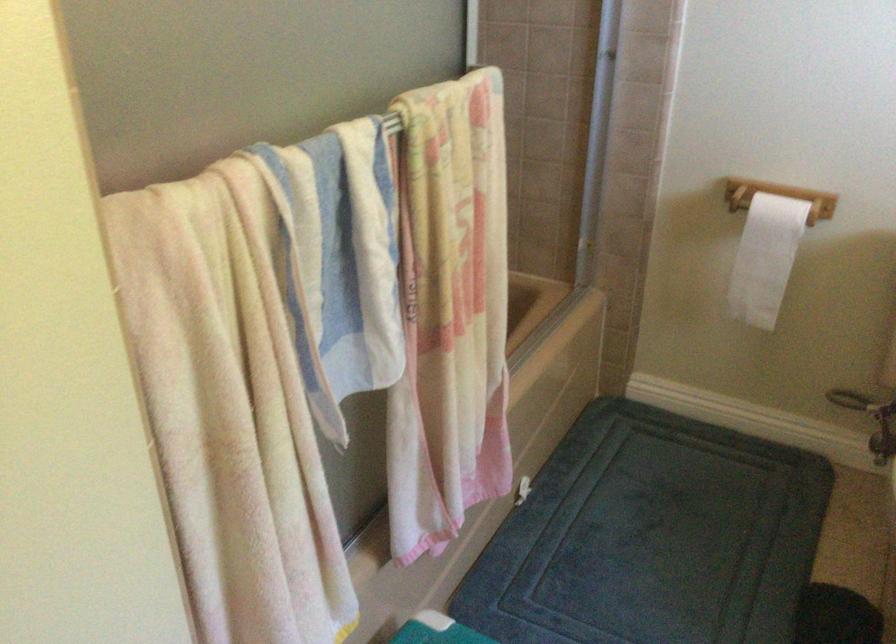
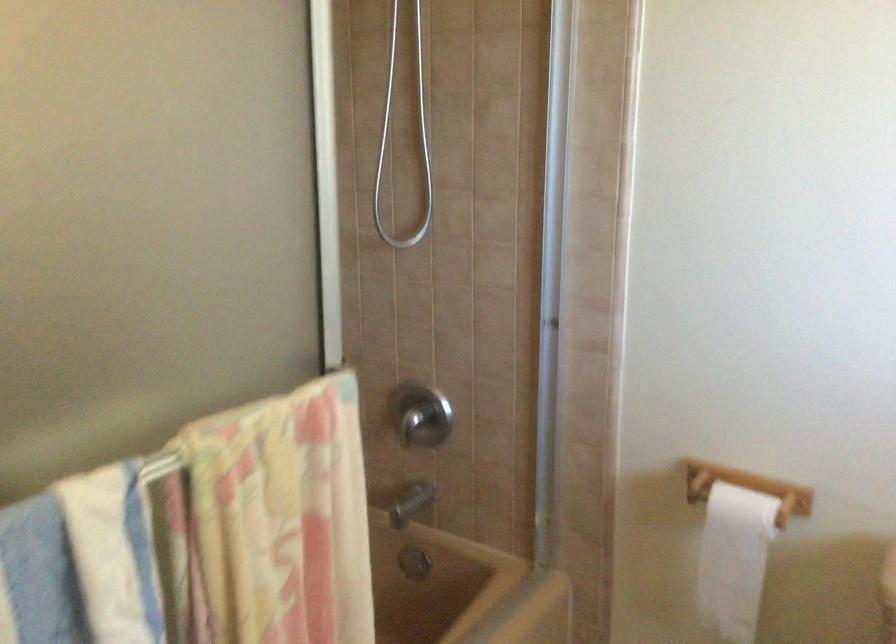
The images are taken continuously from a first-person perspective. In which direction are you moving?

The cameraman moved toward right, forward.